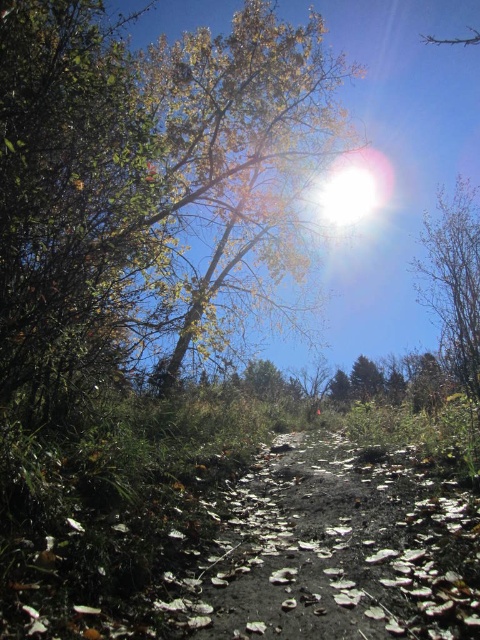
Who is more forward, (169, 93) or (466, 380)?

Point (466, 380)

Where is `yellow-green leaves at upper center`? yellow-green leaves at upper center is located at coordinates (245, 152).

Image resolution: width=480 pixels, height=640 pixels. I want to click on yellow-green leaves at upper center, so click(x=245, y=152).

Does brown dirt path at center have a lesser width compared to yellow-green leaves at upper center?

In fact, brown dirt path at center might be wider than yellow-green leaves at upper center.

Is brown dirt path at center positioned in front of yellow-green leaves at upper center?

Yes.

Who is more forward, (457, 573) or (226, 225)?

Positioned in front is point (457, 573).

The width and height of the screenshot is (480, 640). Identify the location of brown dirt path at center. (338, 550).

I want to click on brown dirt path at center, so click(x=338, y=550).

Is brown dirt path at center above bare branches at right?

No, brown dirt path at center is not above bare branches at right.

The height and width of the screenshot is (640, 480). Identify the location of brown dirt path at center. (338, 550).